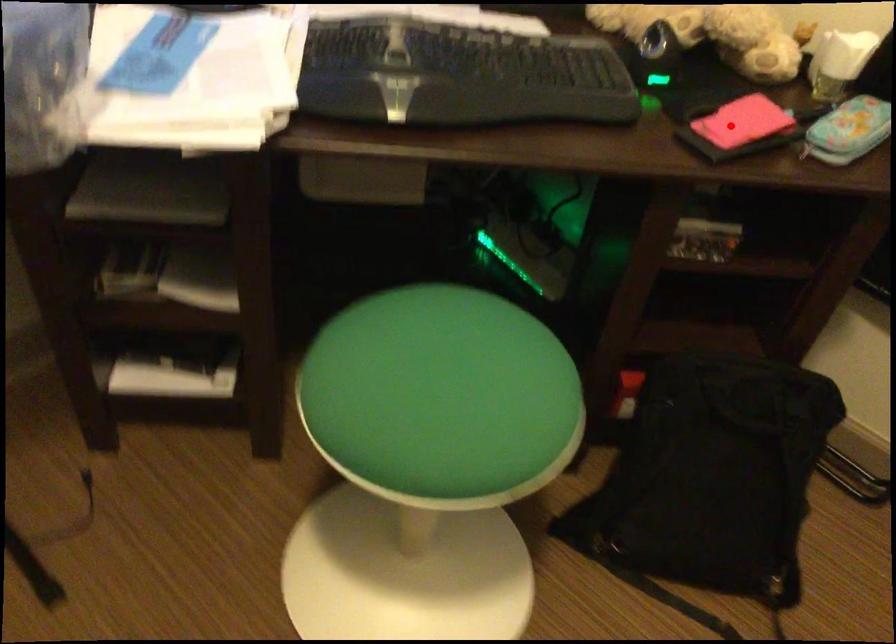
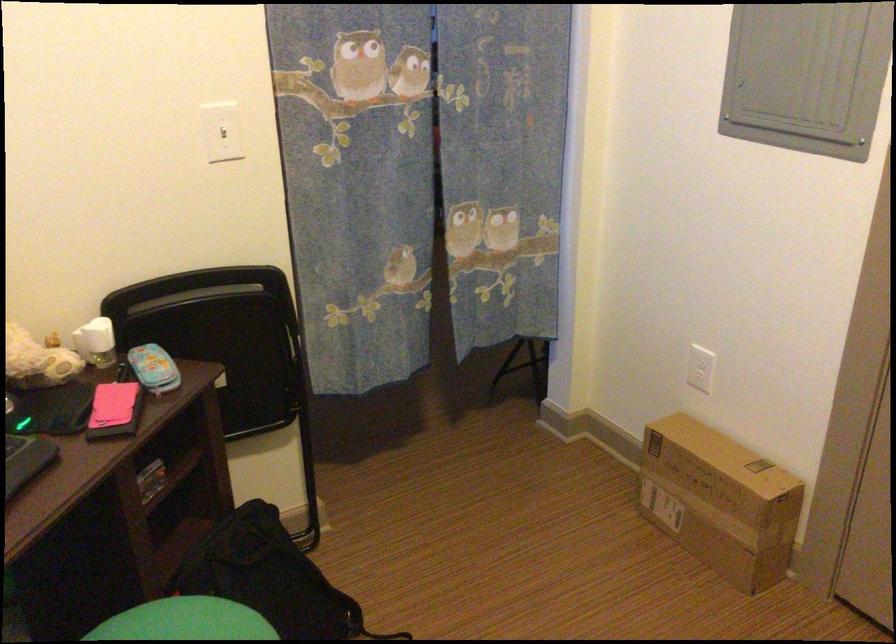
Question: I am providing you with two images of the same scene from different viewpoints. A red point is marked on the first image. At the location where the point appears in image 1, is it still visible in image 2?

Choices:
 (A) Yes
 (B) No

Answer: (A)